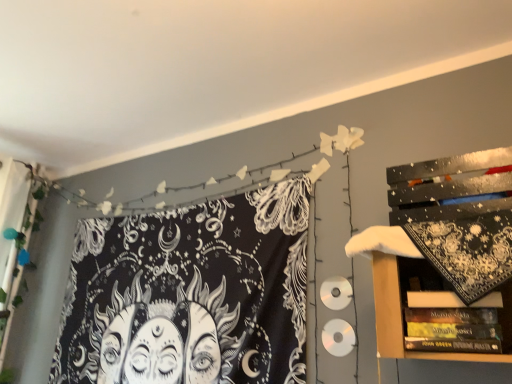
You are a GUI agent. You are given a task and a screenshot of the screen. Output one action in this format:
    pyautogui.click(x=<x>, y=<y>)
    Task: Click on the black printed fabric at upper left
    This screenshot has width=512, height=384.
    Given the screenshot: What is the action you would take?
    pyautogui.click(x=190, y=294)

The width and height of the screenshot is (512, 384). What do you see at coordinates (190, 294) in the screenshot? I see `black printed fabric at upper left` at bounding box center [190, 294].

I want to click on hardcover books at lower right, so click(415, 275).

What do you see at coordinates (415, 275) in the screenshot?
I see `hardcover books at lower right` at bounding box center [415, 275].

At what (x,y) coordinates should I click in order to perform the action: click on black printed fabric at upper left. Please return your answer as a coordinate pair (x, y). Looking at the image, I should click on (190, 294).

Would you say black printed fabric at upper left is to the left or to the right of hardcover books at lower right in the picture?

black printed fabric at upper left is positioned on hardcover books at lower right's left side.

Which is behind, black printed fabric at upper left or hardcover books at lower right?

black printed fabric at upper left is further from the camera.

Which is behind, point (251, 276) or point (435, 277)?

Positioned behind is point (251, 276).

From the image's perspective, would you say black printed fabric at upper left is positioned over hardcover books at lower right?

No.

From a real-world perspective, is black printed fabric at upper left beneath hardcover books at lower right?

No, from a real-world perspective, black printed fabric at upper left is not below hardcover books at lower right.

Is black printed fabric at upper left wider than hardcover books at lower right?

Incorrect, the width of black printed fabric at upper left does not surpass that of hardcover books at lower right.

Is black printed fabric at upper left shorter than hardcover books at lower right?

No, black printed fabric at upper left is not shorter than hardcover books at lower right.

Does black printed fabric at upper left have a smaller size compared to hardcover books at lower right?

Incorrect, black printed fabric at upper left is not smaller in size than hardcover books at lower right.

Is hardcover books at lower right inside black printed fabric at upper left?

No, hardcover books at lower right is not inside black printed fabric at upper left.

Is black printed fabric at upper left far from hardcover books at lower right?

Absolutely, black printed fabric at upper left is distant from hardcover books at lower right.

Could you tell me if black printed fabric at upper left is facing hardcover books at lower right?

No, black printed fabric at upper left is not turned towards hardcover books at lower right.

How many degrees apart are the facing directions of black printed fabric at upper left and hardcover books at lower right?

The facing directions of black printed fabric at upper left and hardcover books at lower right are 3.83 degrees apart.

How far apart are black printed fabric at upper left and hardcover books at lower right?

black printed fabric at upper left is 3.43 feet from hardcover books at lower right.

I want to click on shelf above the black printed fabric at upper left (from the image's perspective), so click(x=415, y=275).

Between hardcover books at lower right and black printed fabric at upper left, which one appears on the left side from the viewer's perspective?

black printed fabric at upper left.

Does hardcover books at lower right lie in front of black printed fabric at upper left?

Yes, hardcover books at lower right is in front of black printed fabric at upper left.

Is point (497, 289) in front of point (272, 267)?

Yes, it is.

From the image's perspective, which is above, hardcover books at lower right or black printed fabric at upper left?

hardcover books at lower right, from the image's perspective.

From a real-world perspective, does hardcover books at lower right stand above black printed fabric at upper left?

Actually, hardcover books at lower right is physically below black printed fabric at upper left in the real world.

Considering the relative sizes of hardcover books at lower right and black printed fabric at upper left in the image provided, is hardcover books at lower right thinner than black printed fabric at upper left?

No.

Considering the sizes of hardcover books at lower right and black printed fabric at upper left in the image, is hardcover books at lower right taller or shorter than black printed fabric at upper left?

Clearly, hardcover books at lower right is shorter compared to black printed fabric at upper left.

Is hardcover books at lower right smaller than black printed fabric at upper left?

Indeed, hardcover books at lower right has a smaller size compared to black printed fabric at upper left.

Is black printed fabric at upper left completely or partially inside hardcover books at lower right?

No, hardcover books at lower right does not contain black printed fabric at upper left.

Is hardcover books at lower right not near black printed fabric at upper left?

Yes, hardcover books at lower right is far from black printed fabric at upper left.

Is hardcover books at lower right facing away from black printed fabric at upper left?

hardcover books at lower right does not have its back to black printed fabric at upper left.

How much distance is there between hardcover books at lower right and black printed fabric at upper left?

hardcover books at lower right is 3.43 feet away from black printed fabric at upper left.

This screenshot has width=512, height=384. I want to click on shelf below the black printed fabric at upper left (from a real-world perspective), so click(x=415, y=275).

Locate an element on the screen. This screenshot has height=384, width=512. fabric behind the hardcover books at lower right is located at coordinates (x=190, y=294).

The image size is (512, 384). Identify the location of fabric above the hardcover books at lower right (from a real-world perspective). (190, 294).